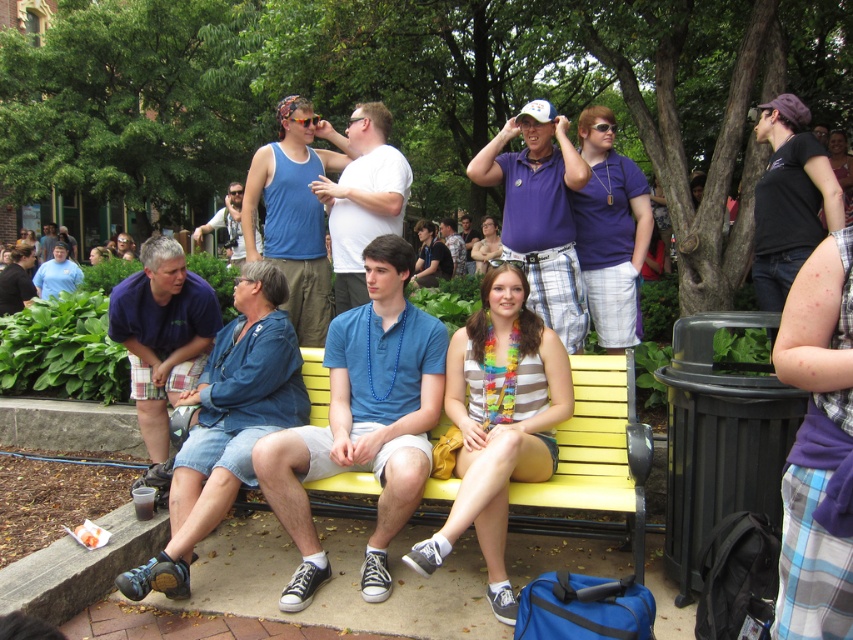
You are a photographer trying to capture a photo of the blue cotton tank top at upper center and the matte blue shirt at left. Which one is positioned lower in the image?

The blue cotton tank top at upper center is positioned below the matte blue shirt at left, so it is lower in the image.